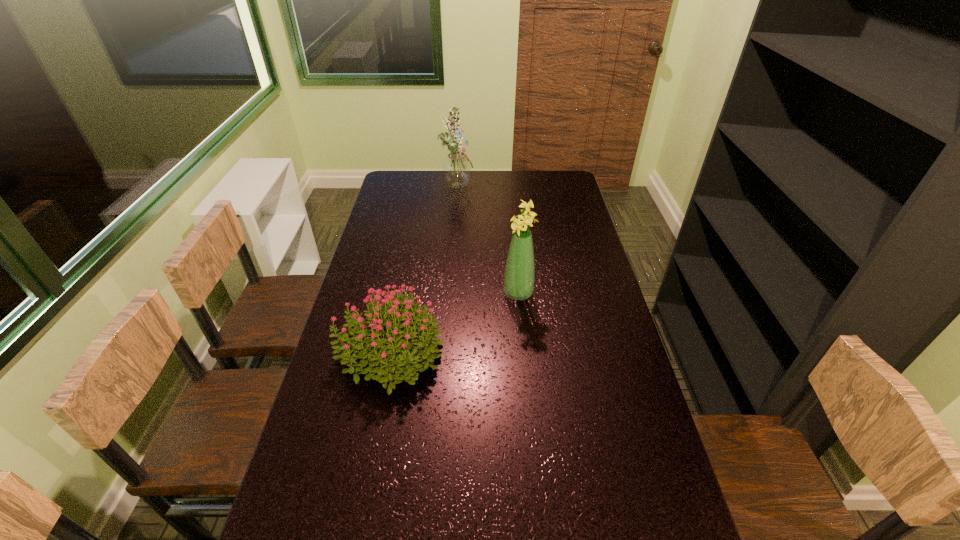
At what (x,y) coordinates should I click in order to perform the action: click on object present at the far edge. Please return your answer as a coordinate pair (x, y). Looking at the image, I should click on (456, 167).

You are a GUI agent. You are given a task and a screenshot of the screen. Output one action in this format:
    pyautogui.click(x=<x>, y=<y>)
    Task: Click on the object present at the left edge
    This screenshot has width=960, height=540.
    Given the screenshot: What is the action you would take?
    pyautogui.click(x=383, y=356)

At what (x,y) coordinates should I click in order to perform the action: click on vacant space at the far edge. Please return your answer as a coordinate pair (x, y). This screenshot has height=540, width=960. Looking at the image, I should click on (422, 187).

Where is `vacant region at the right edge of the desktop`? vacant region at the right edge of the desktop is located at coordinates (579, 204).

At what (x,y) coordinates should I click in order to perform the action: click on vacant space at the far left corner of the desktop. Please return your answer as a coordinate pair (x, y). The image size is (960, 540). Looking at the image, I should click on (400, 172).

Locate an element on the screen. The width and height of the screenshot is (960, 540). vacant space at the far right corner is located at coordinates (570, 182).

I want to click on free spot between the shortest bouquet and the farthest object, so [x=423, y=267].

Image resolution: width=960 pixels, height=540 pixels. I want to click on free space between the farthest bouquet and the second nearest object, so click(488, 239).

Select which object appears as the closest to the nearest bouquet. Please provide its 2D coordinates. Your answer should be formatted as a tuple, i.e. [(x, y)], where the tuple contains the x and y coordinates of a point satisfying the conditions above.

[(519, 276)]

Image resolution: width=960 pixels, height=540 pixels. What are the coordinates of `object that is the closest one to the rightmost object` in the screenshot? It's located at [383, 356].